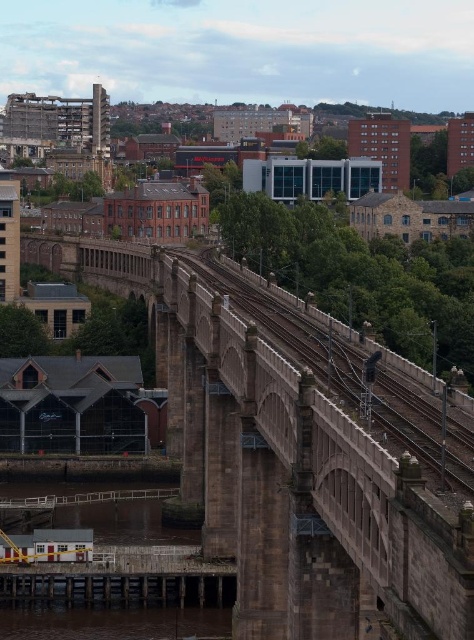
Who is positioned more to the right, brown stone bridge at center or brown stone train track at center?

Positioned to the right is brown stone train track at center.

Is the position of brown stone bridge at center more distant than that of brown stone train track at center?

No, it is in front of brown stone train track at center.

Who is more forward, (x=210, y=362) or (x=216, y=273)?

Point (x=210, y=362) is in front.

This screenshot has width=474, height=640. In order to click on brown stone bridge at center in this screenshot , I will do `click(283, 468)`.